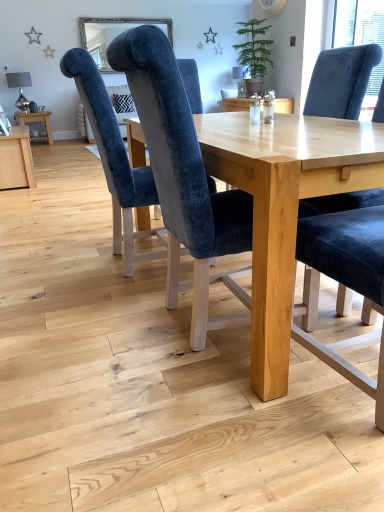
Identify the location of free spot to the left of velvet blue chair at center, which is counted as the 1th chair, starting from the right. (255, 409).